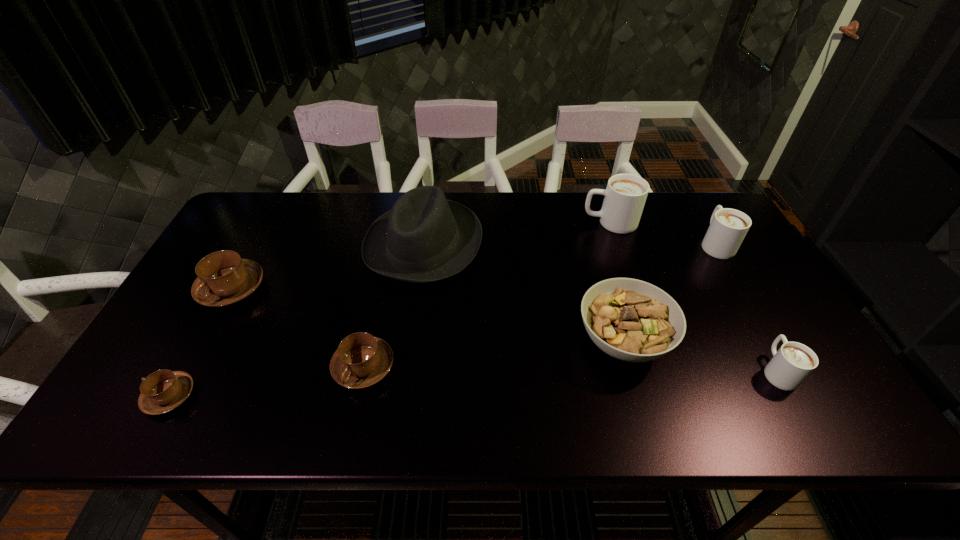
Identify the location of gray fedora. This screenshot has width=960, height=540. (424, 238).

Where is `the leftmost white cappuccino`? The image size is (960, 540). the leftmost white cappuccino is located at coordinates (625, 195).

This screenshot has width=960, height=540. Identify the location of the biggest white cappuccino. (625, 195).

I want to click on the second tallest cappuccino, so click(x=728, y=227).

At what (x,y) coordinates should I click in order to perform the action: click on gray stew. Please return your answer as a coordinate pair (x, y). Looking at the image, I should click on (631, 320).

Locate an element on the screen. the third farthest cappuccino is located at coordinates (224, 279).

Image resolution: width=960 pixels, height=540 pixels. Identify the location of the biggest brown cappuccino. (224, 279).

Identify the location of the nearest white cappuccino. (793, 362).

Where is `the second biggest brown cappuccino`? Image resolution: width=960 pixels, height=540 pixels. the second biggest brown cappuccino is located at coordinates (361, 360).

Identify the location of the rightmost brown cappuccino. This screenshot has height=540, width=960. (361, 360).